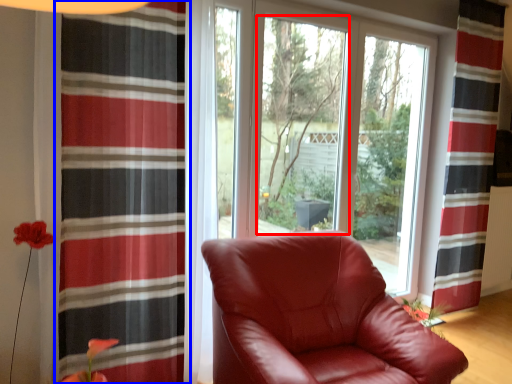
Question: Which of the following is the farthest to the observer, window screen (highlighted by a red box) or curtain (highlighted by a blue box)?

Choices:
 (A) window screen
 (B) curtain

Answer: (A)